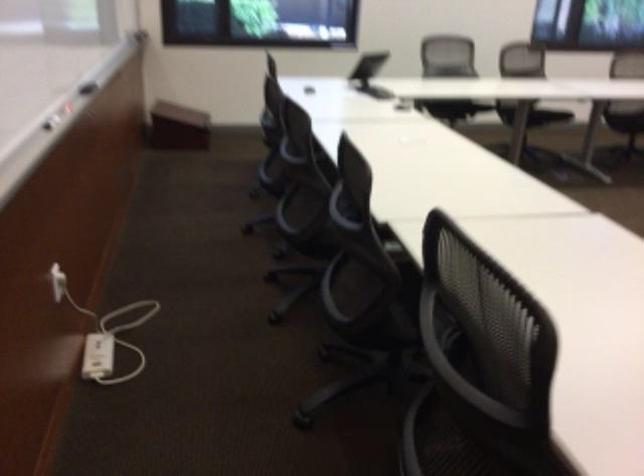
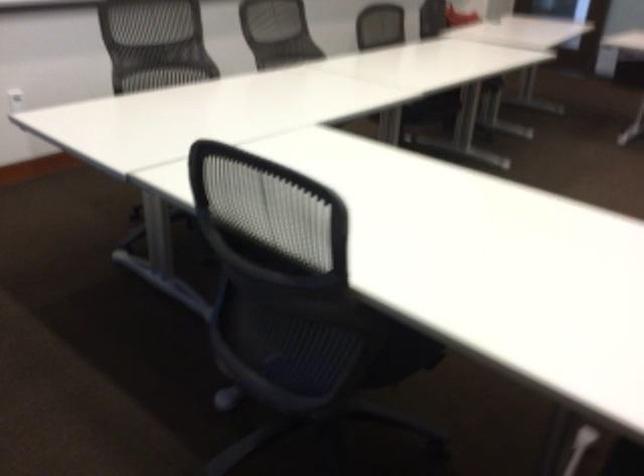
Question: The images are taken continuously from a first-person perspective. In which direction are you moving?

Choices:
 (A) Left
 (B) Right
 (C) Forward
 (D) Backward

Answer: (D)